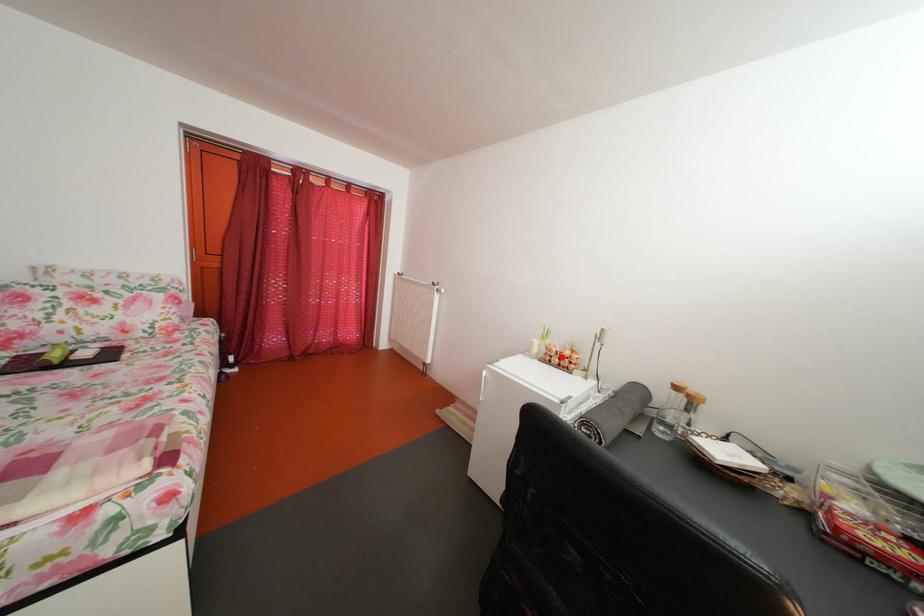
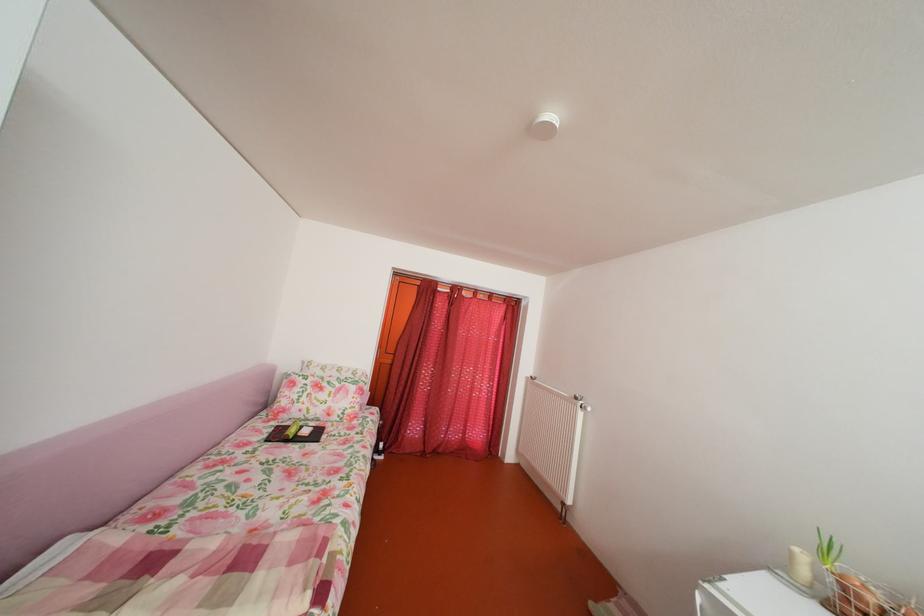
Locate, in the second image, the point that corresponds to the highlighted location in the first image.

(871, 605)